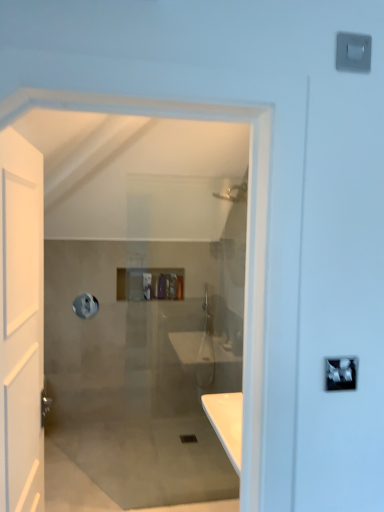
Question: Does translucent plastic toiletries at center appear on the left side of silver metallic towel bar at upper left?

Choices:
 (A) yes
 (B) no

Answer: (B)

Question: Can you confirm if translucent plastic toiletries at center is positioned to the right of silver metallic towel bar at upper left?

Choices:
 (A) no
 (B) yes

Answer: (B)

Question: Would you say silver metallic towel bar at upper left is part of translucent plastic toiletries at center's contents?

Choices:
 (A) yes
 (B) no

Answer: (B)

Question: Is translucent plastic toiletries at center turned away from silver metallic towel bar at upper left?

Choices:
 (A) no
 (B) yes

Answer: (A)

Question: Is translucent plastic toiletries at center in front of silver metallic towel bar at upper left?

Choices:
 (A) no
 (B) yes

Answer: (A)

Question: Is translucent plastic toiletries at center smaller than silver metallic towel bar at upper left?

Choices:
 (A) no
 (B) yes

Answer: (A)

Question: Considering the relative sizes of silver metallic lock at upper right and silver metallic towel bar at upper left in the image provided, is silver metallic lock at upper right thinner than silver metallic towel bar at upper left?

Choices:
 (A) no
 (B) yes

Answer: (A)

Question: Is silver metallic lock at upper right shorter than silver metallic towel bar at upper left?

Choices:
 (A) no
 (B) yes

Answer: (B)

Question: From a real-world perspective, is silver metallic lock at upper right physically below silver metallic towel bar at upper left?

Choices:
 (A) yes
 (B) no

Answer: (B)

Question: Does silver metallic lock at upper right appear on the left side of silver metallic towel bar at upper left?

Choices:
 (A) yes
 (B) no

Answer: (B)

Question: Considering the relative positions of silver metallic lock at upper right and silver metallic towel bar at upper left in the image provided, is silver metallic lock at upper right in front of silver metallic towel bar at upper left?

Choices:
 (A) no
 (B) yes

Answer: (B)

Question: From the image's perspective, is silver metallic lock at upper right below silver metallic towel bar at upper left?

Choices:
 (A) yes
 (B) no

Answer: (B)

Question: Does silver metallic lock at upper right appear on the right side of translucent plastic toiletries at center?

Choices:
 (A) no
 (B) yes

Answer: (B)